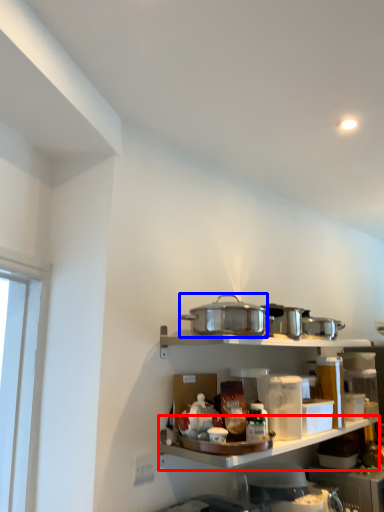
Question: Which object is further to the camera taking this photo, shelf (highlighted by a red box) or appliance (highlighted by a blue box)?

Choices:
 (A) shelf
 (B) appliance

Answer: (B)